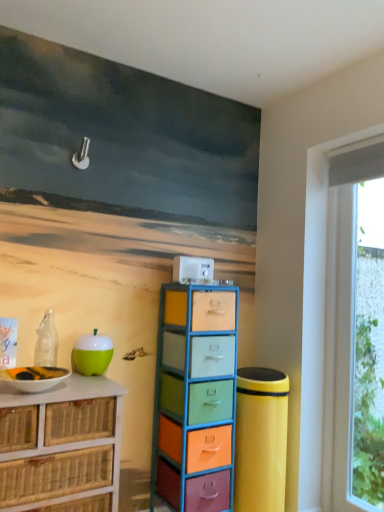
Question: From a real-world perspective, is multicolored plastic drawers at center, arranged as the 2th chest of drawers when viewed from the left, physically located above or below white glossy bowl at lower left?

Choices:
 (A) above
 (B) below

Answer: (B)

Question: Looking at the image, does multicolored plastic drawers at center, which appears as the 1th chest of drawers when viewed from the right, seem bigger or smaller compared to white glossy bowl at lower left?

Choices:
 (A) big
 (B) small

Answer: (A)

Question: Based on their relative distances, which object is nearer to the white wicker chest of drawers at left, the first chest of drawers from the left?

Choices:
 (A) transparent glass window at right
 (B) multicolored plastic drawers at center, which appears as the 1th chest of drawers when viewed from the right
 (C) white glossy bowl at lower left

Answer: (C)

Question: Estimate the real-world distances between objects in this image. Which object is closer to the multicolored plastic drawers at center, arranged as the 2th chest of drawers when viewed from the left?

Choices:
 (A) white wicker chest of drawers at left, the second chest of drawers viewed from the right
 (B) white glossy bowl at lower left
 (C) transparent glass window at right

Answer: (A)